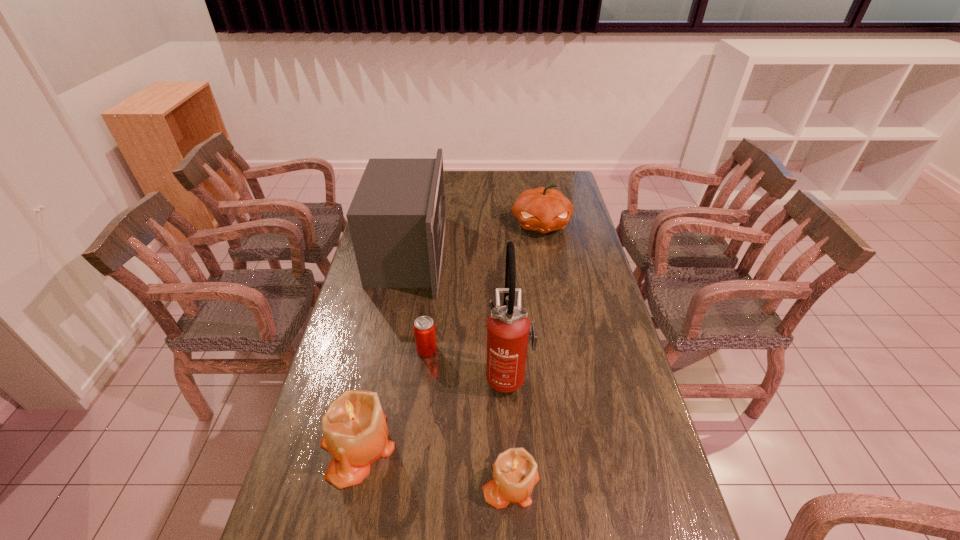
Find the location of a particular element. The height and width of the screenshot is (540, 960). free space located 0.180m at the nozzle of the fire extinguisher is located at coordinates (425, 375).

Where is `vacant area situated at the nozzle of the fire extinguisher`? Image resolution: width=960 pixels, height=540 pixels. vacant area situated at the nozzle of the fire extinguisher is located at coordinates (445, 375).

At what (x,y) coordinates should I click in order to perform the action: click on vacant area located 0.120m at the nozzle of the fire extinguisher. Please return your answer as a coordinate pair (x, y). The height and width of the screenshot is (540, 960). Looking at the image, I should click on (445, 375).

Where is `vacant space located 0.060m on the left of the can`? This screenshot has width=960, height=540. vacant space located 0.060m on the left of the can is located at coordinates (397, 350).

This screenshot has height=540, width=960. I want to click on object present at the near edge, so click(x=515, y=473).

At what (x,y) coordinates should I click in order to perform the action: click on candle positioned at the left edge. Please return your answer as a coordinate pair (x, y). The image size is (960, 540). Looking at the image, I should click on (355, 432).

Where is `microwave oven located at the left edge`? This screenshot has height=540, width=960. microwave oven located at the left edge is located at coordinates (397, 218).

The image size is (960, 540). I want to click on object that is at the right edge, so click(x=543, y=210).

The image size is (960, 540). Identify the location of vacant point at the far edge. (538, 174).

This screenshot has height=540, width=960. I want to click on vacant space at the left edge of the desktop, so click(x=308, y=469).